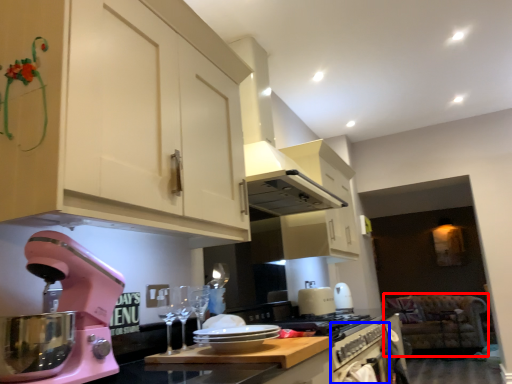
Question: Among these objects, which one is nearest to the camera, sit (highlighted by a red box) or oven (highlighted by a blue box)?

Choices:
 (A) sit
 (B) oven

Answer: (B)